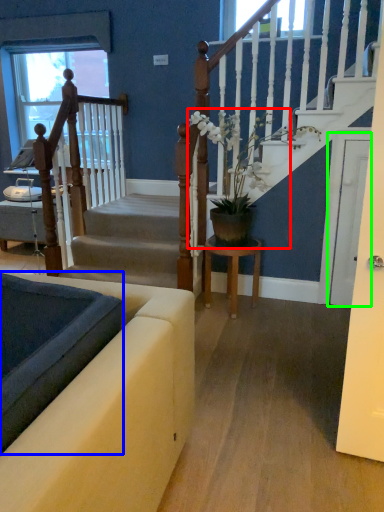
Question: Which object is the farthest from houseplant (highlighted by a red box)? Choose among these: landing (highlighted by a blue box) or glass door (highlighted by a green box).

Choices:
 (A) landing
 (B) glass door

Answer: (A)